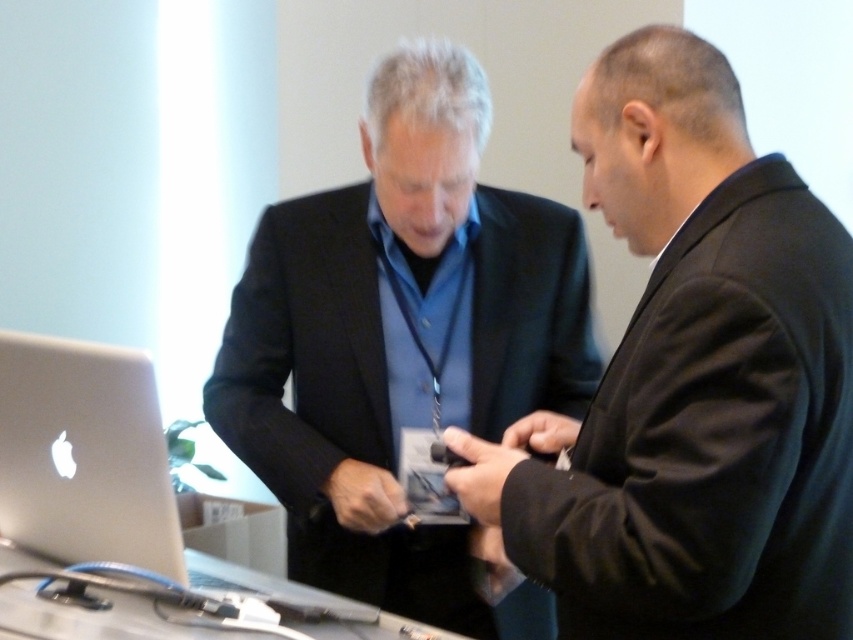
Is point (699, 534) positioned behind point (9, 378)?

That is False.

Which of these two, black matte suit at center or silver metallic laptop at lower left, stands shorter?

With less height is silver metallic laptop at lower left.

Locate an element on the screen. The width and height of the screenshot is (853, 640). black matte suit at center is located at coordinates (692, 381).

What do you see at coordinates (109, 474) in the screenshot? The width and height of the screenshot is (853, 640). I see `silver metallic laptop at lower left` at bounding box center [109, 474].

Is silver metallic laptop at lower left bigger than metallic gray table at lower center?

Yes, silver metallic laptop at lower left is bigger than metallic gray table at lower center.

Find the location of `silver metallic laptop at lower left`. silver metallic laptop at lower left is located at coordinates (109, 474).

Is matte black suit at center to the left of silver metallic laptop at lower left from the viewer's perspective?

Incorrect, matte black suit at center is not on the left side of silver metallic laptop at lower left.

Is point (354, 445) in front of point (202, 589)?

No, it is behind (202, 589).

The image size is (853, 640). Identify the location of matte black suit at center. (402, 342).